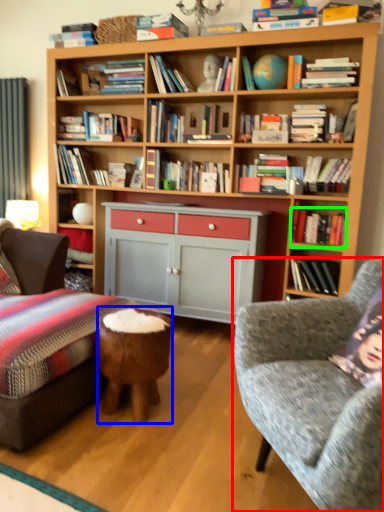
Question: Which object is positioned closest to studio couch (highlighted by a red box)? Select from stool (highlighted by a blue box) and book (highlighted by a green box).

Choices:
 (A) stool
 (B) book

Answer: (A)